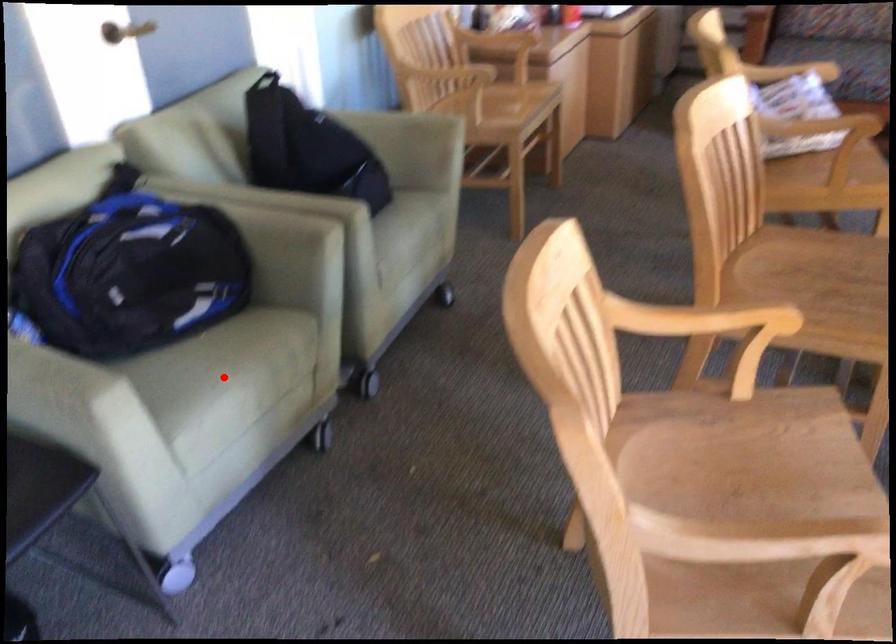
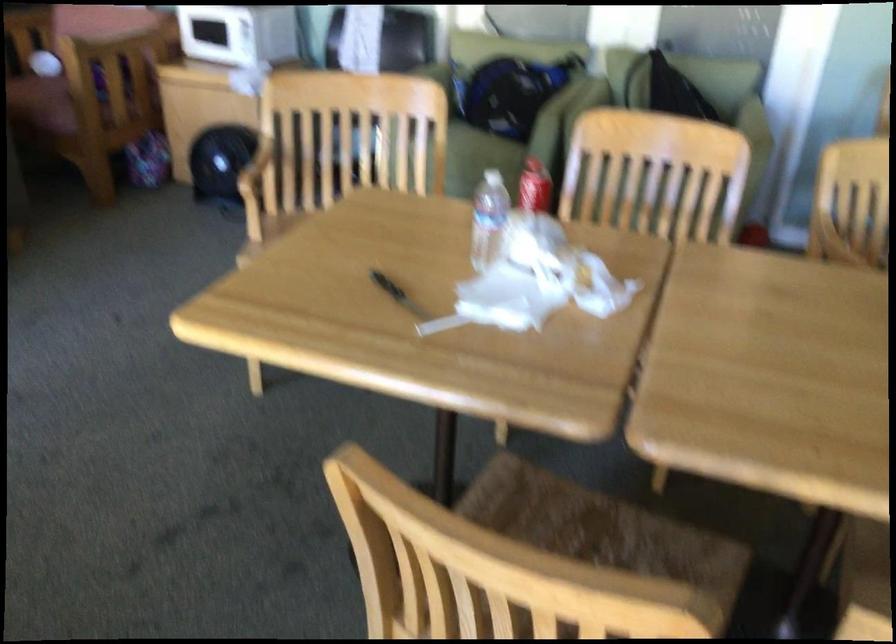
Question: I am providing you with two images of the same scene from different viewpoints. A red point is marked on the first image. At the location where the point appears in image 1, is it still visible in image 2?

Choices:
 (A) Yes
 (B) No

Answer: (B)